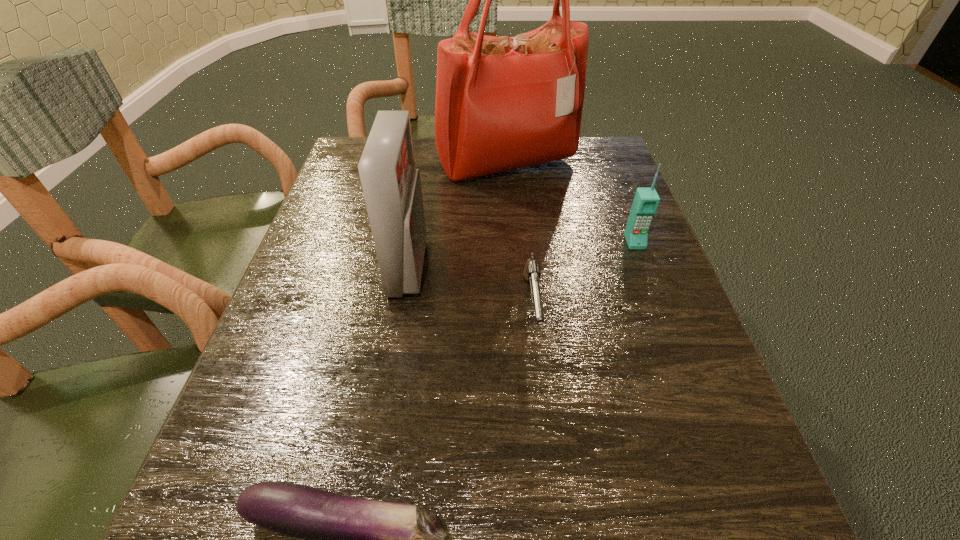
Locate an element on the screen. unoccupied area between the cellular telephone and the gun is located at coordinates (583, 274).

Identify the location of free space that is in between the gun and the third shortest object. The image size is (960, 540). (583, 274).

You are a GUI agent. You are given a task and a screenshot of the screen. Output one action in this format:
    pyautogui.click(x=<x>, y=<y>)
    Task: Click on the free point between the second tallest object and the tallest object
    The image size is (960, 540).
    Given the screenshot: What is the action you would take?
    pyautogui.click(x=458, y=215)

You are a GUI agent. You are given a task and a screenshot of the screen. Output one action in this format:
    pyautogui.click(x=<x>, y=<y>)
    Task: Click on the free space between the tallest object and the cellular telephone
    This screenshot has height=540, width=960.
    Given the screenshot: What is the action you would take?
    pyautogui.click(x=570, y=202)

Find the location of a particular element. The height and width of the screenshot is (540, 960). vacant space in between the farthest object and the third tallest object is located at coordinates (570, 202).

The image size is (960, 540). I want to click on vacant space that's between the rightmost object and the tallest object, so click(x=570, y=202).

This screenshot has height=540, width=960. I want to click on free space between the fourth shortest object and the handbag, so click(458, 215).

Where is `blank region between the second shortest object and the second tallest object`? The height and width of the screenshot is (540, 960). blank region between the second shortest object and the second tallest object is located at coordinates (470, 287).

I want to click on blank region between the first-aid kit and the farthest object, so [458, 215].

At what (x,y) coordinates should I click in order to perform the action: click on object that can be found as the third closest to the eggplant. Please return your answer as a coordinate pair (x, y). The width and height of the screenshot is (960, 540). Looking at the image, I should click on (646, 200).